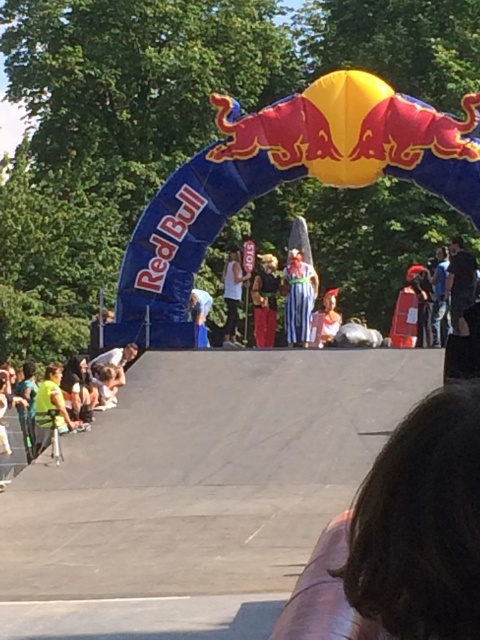
Is gray concrete skate park at center thinner than blue denim jeans at center?

No, gray concrete skate park at center is not thinner than blue denim jeans at center.

Locate an element on the screen. gray concrete skate park at center is located at coordinates (197, 492).

Identify the location of gray concrete skate park at center. (197, 492).

Who is more distant from viewer, [272,314] or [203,333]?

The point [272,314] is behind.

Between point (259, 284) and point (200, 339), which one is positioned behind?

The point (259, 284) is more distant.

Where is `reddish-orange fabric pants at center`? The image size is (480, 640). reddish-orange fabric pants at center is located at coordinates (264, 300).

Is black cotton shirt at right taller than white matte tank top at center?

Incorrect, black cotton shirt at right's height is not larger of white matte tank top at center's.

Can you confirm if black cotton shirt at right is smaller than white matte tank top at center?

Indeed, black cotton shirt at right has a smaller size compared to white matte tank top at center.

Between point (457, 301) and point (235, 298), which one is positioned behind?

Point (235, 298)

At what (x,y) coordinates should I click in order to perform the action: click on black cotton shirt at right. Please return your answer as a coordinate pair (x, y). The width and height of the screenshot is (480, 640). Looking at the image, I should click on (459, 280).